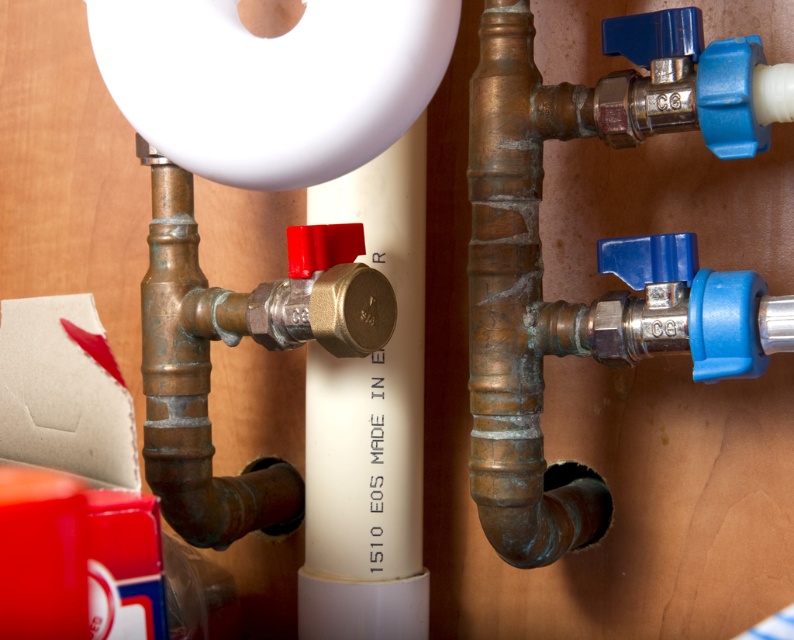
Question: Which point is closer to the camera?

Choices:
 (A) (777, 102)
 (B) (168, 296)

Answer: (A)

Question: Can you confirm if bronze copper pipe at center is positioned to the right of brass water pipe at center?

Choices:
 (A) no
 (B) yes

Answer: (B)

Question: In this image, where is bronze copper pipe at center located relative to brass water pipe at center?

Choices:
 (A) right
 (B) left

Answer: (A)

Question: Which point appears closest to the camera in this image?

Choices:
 (A) (189, 188)
 (B) (769, 93)

Answer: (B)

Question: Does bronze copper pipe at center appear on the right side of brass water pipe at center?

Choices:
 (A) yes
 (B) no

Answer: (A)